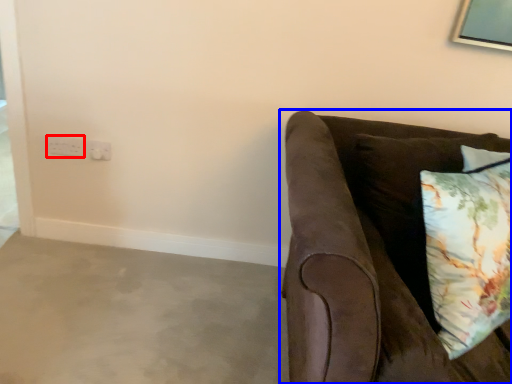
Question: Which object appears farthest to the camera in this image, electric outlet (highlighted by a red box) or studio couch (highlighted by a blue box)?

Choices:
 (A) electric outlet
 (B) studio couch

Answer: (A)